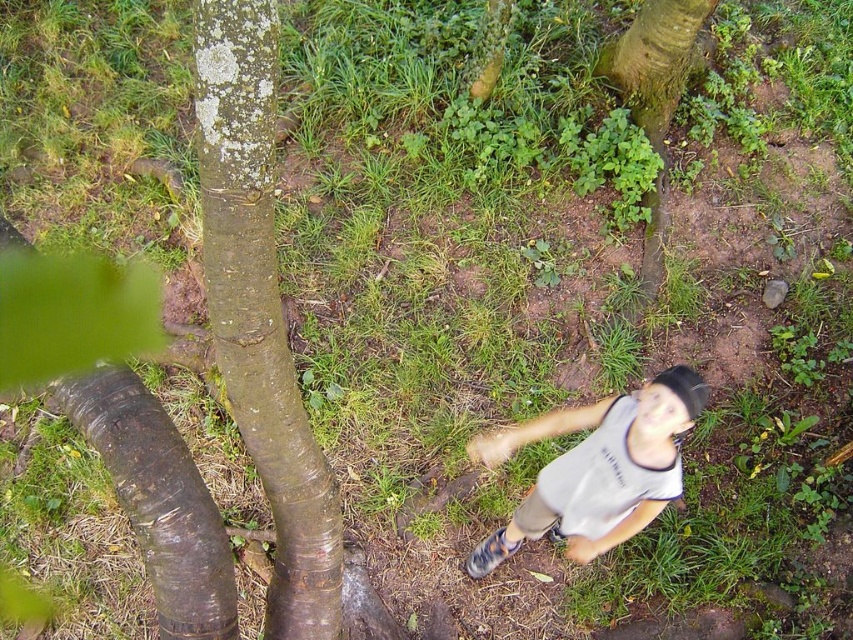
Question: Which of the following is the farthest from the observer?

Choices:
 (A) (598, 68)
 (B) (257, 321)
 (C) (643, 420)

Answer: (A)

Question: Which object is positioned farthest from the brown rough bark at left?

Choices:
 (A) green mossy tree trunk at upper center
 (B) gray cotton shirt at center

Answer: (A)

Question: Is brown rough bark at left closer to camera compared to green mossy tree trunk at upper center?

Choices:
 (A) no
 (B) yes

Answer: (B)

Question: Which of the following is the farthest from the observer?

Choices:
 (A) brown rough bark at left
 (B) green mossy tree trunk at upper center
 (C) gray cotton shirt at center

Answer: (B)

Question: Is the position of gray cotton shirt at center more distant than that of green mossy tree trunk at upper center?

Choices:
 (A) yes
 (B) no

Answer: (B)

Question: Is brown rough bark at left wider than green mossy tree trunk at upper center?

Choices:
 (A) no
 (B) yes

Answer: (A)